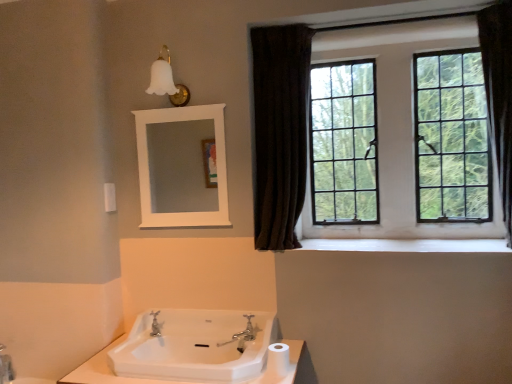
Image resolution: width=512 pixels, height=384 pixels. In order to click on vacant area in front of silver metallic tap at lower center in this screenshot , I will do `click(146, 353)`.